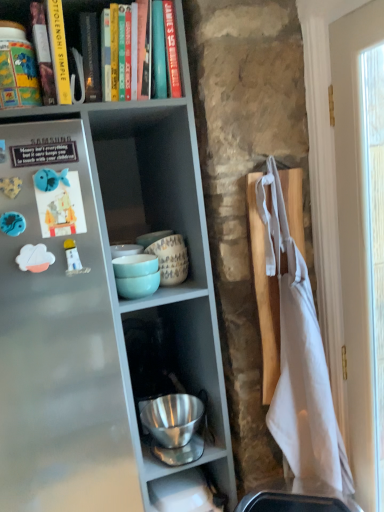
Question: Is the position of metallic gray shelf at upper left more distant than that of hardcover book at upper left?

Choices:
 (A) no
 (B) yes

Answer: (A)

Question: Would you say hardcover book at upper left is part of metallic gray shelf at upper left's contents?

Choices:
 (A) yes
 (B) no

Answer: (A)

Question: Can you confirm if metallic gray shelf at upper left is shorter than hardcover book at upper left?

Choices:
 (A) yes
 (B) no

Answer: (B)

Question: Is metallic gray shelf at upper left to the left of hardcover book at upper left from the viewer's perspective?

Choices:
 (A) no
 (B) yes

Answer: (B)

Question: Can you confirm if metallic gray shelf at upper left is taller than hardcover book at upper left?

Choices:
 (A) yes
 (B) no

Answer: (A)

Question: Is metallic gray shelf at upper left at the right side of hardcover book at upper left?

Choices:
 (A) yes
 (B) no

Answer: (B)

Question: Is hardcover book at upper left located outside metallic gray shelf at upper left?

Choices:
 (A) no
 (B) yes

Answer: (A)

Question: Is the position of hardcover book at upper left more distant than that of metallic gray shelf at upper left?

Choices:
 (A) no
 (B) yes

Answer: (B)

Question: Is hardcover book at upper left oriented towards metallic gray shelf at upper left?

Choices:
 (A) yes
 (B) no

Answer: (A)

Question: From a real-world perspective, is hardcover book at upper left under metallic gray shelf at upper left?

Choices:
 (A) no
 (B) yes

Answer: (A)

Question: Is hardcover book at upper left shorter than metallic gray shelf at upper left?

Choices:
 (A) yes
 (B) no

Answer: (A)

Question: Does hardcover book at upper left have a smaller size compared to metallic gray shelf at upper left?

Choices:
 (A) no
 (B) yes

Answer: (B)

Question: Considering the positions of hardcover book at upper left and metallic gray shelf at upper left in the image, is hardcover book at upper left wider or thinner than metallic gray shelf at upper left?

Choices:
 (A) wide
 (B) thin

Answer: (B)